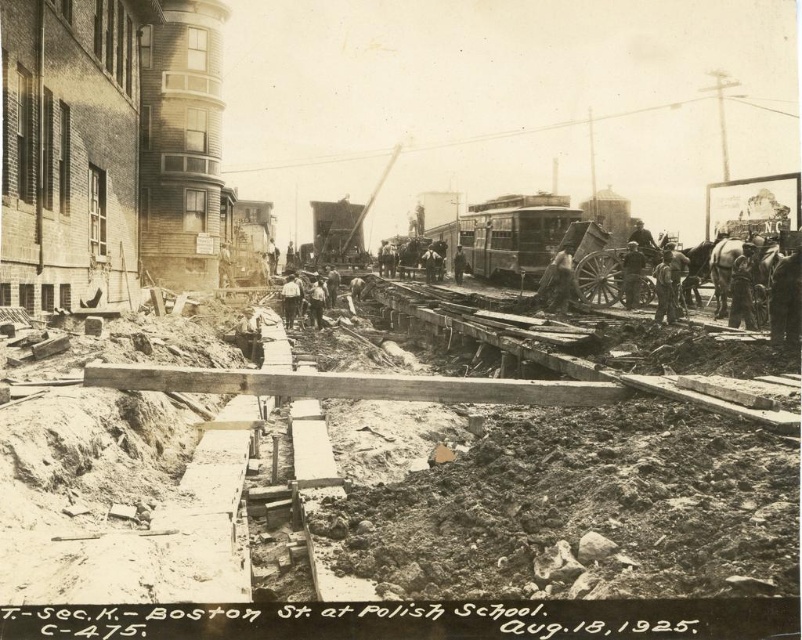
Who is positioned more to the left, dark gray fabric shirt at center or dark brown leather jacket at center?

dark gray fabric shirt at center

Does dark gray fabric shirt at center have a larger size compared to dark brown leather jacket at center?

Correct, dark gray fabric shirt at center is larger in size than dark brown leather jacket at center.

Which is behind, point (553, 291) or point (636, 250)?

The point (553, 291) is behind.

The width and height of the screenshot is (802, 640). In order to click on dark gray fabric shirt at center in this screenshot , I will do `click(561, 280)`.

The image size is (802, 640). Identify the location of wooden planks at center. (608, 506).

You are a GUI agent. You are given a task and a screenshot of the screen. Output one action in this format:
    pyautogui.click(x=<x>, y=<y>)
    Task: Click on the wooden planks at center
    
    Given the screenshot: What is the action you would take?
    pyautogui.click(x=608, y=506)

You are a GUI agent. You are given a task and a screenshot of the screen. Output one action in this format:
    pyautogui.click(x=<x>, y=<y>)
    Task: Click on the wooden planks at center
    The height and width of the screenshot is (640, 802).
    Given the screenshot: What is the action you would take?
    pyautogui.click(x=608, y=506)

Is point (598, 224) closer to camera compared to point (549, 305)?

That is False.

Between point (586, 218) and point (555, 289), which one is positioned behind?

The point (586, 218) is more distant.

Identify the location of metallic silver train car at center. The width and height of the screenshot is (802, 640). (520, 237).